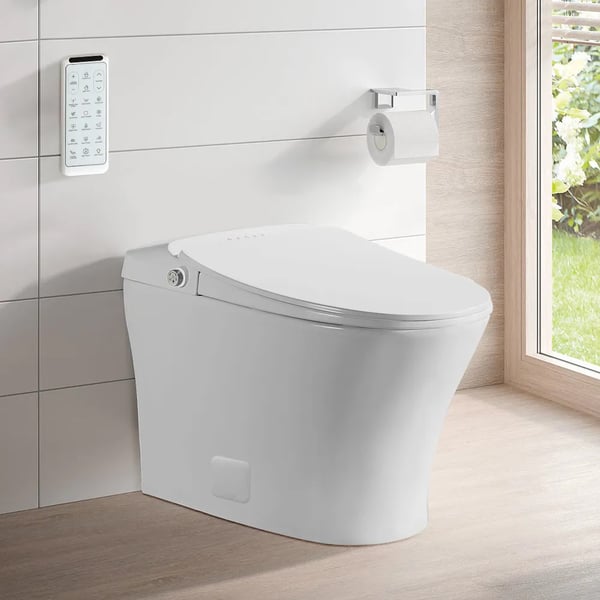
Image resolution: width=600 pixels, height=600 pixels. I want to click on blinds, so click(556, 19).